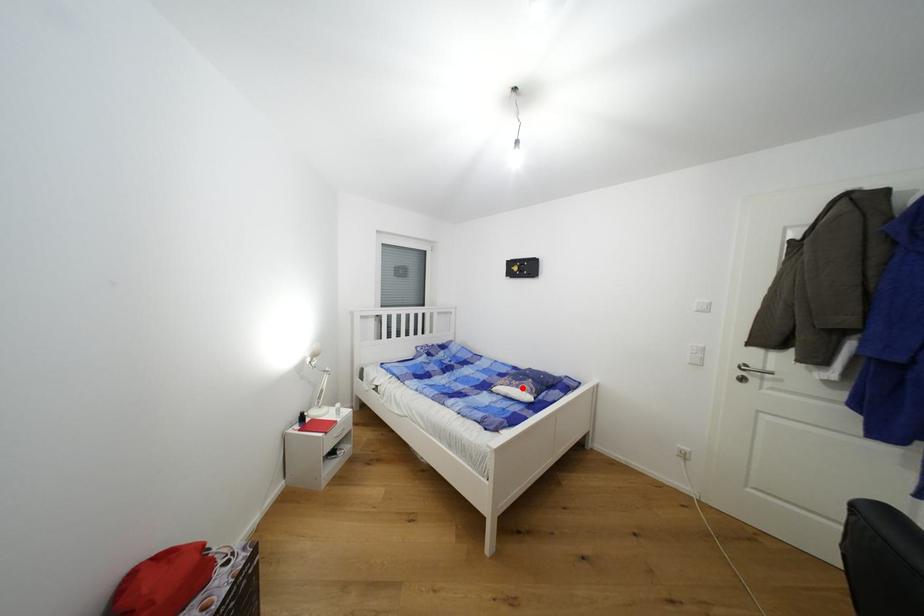
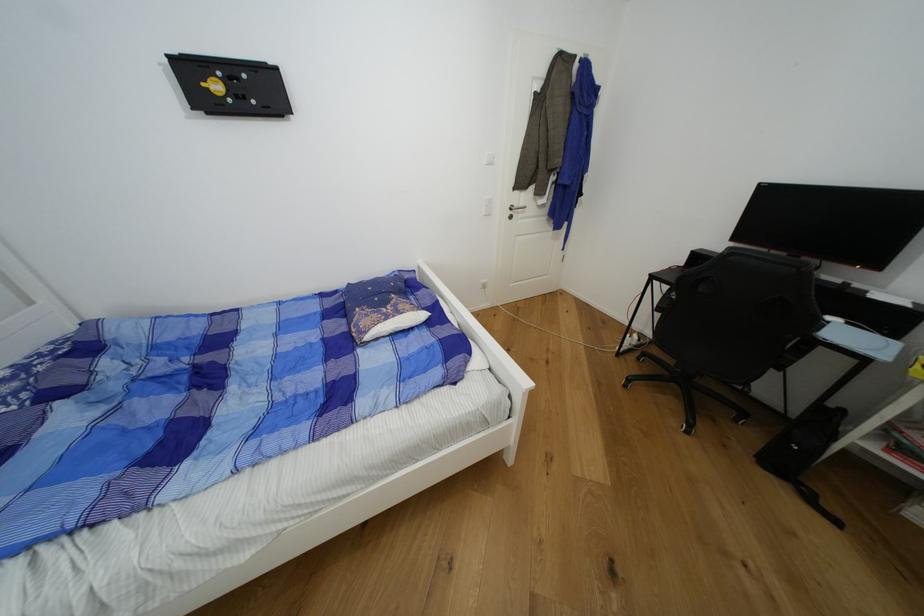
Find the pixel in the second image that matches the highlighted location in the first image.

(404, 314)